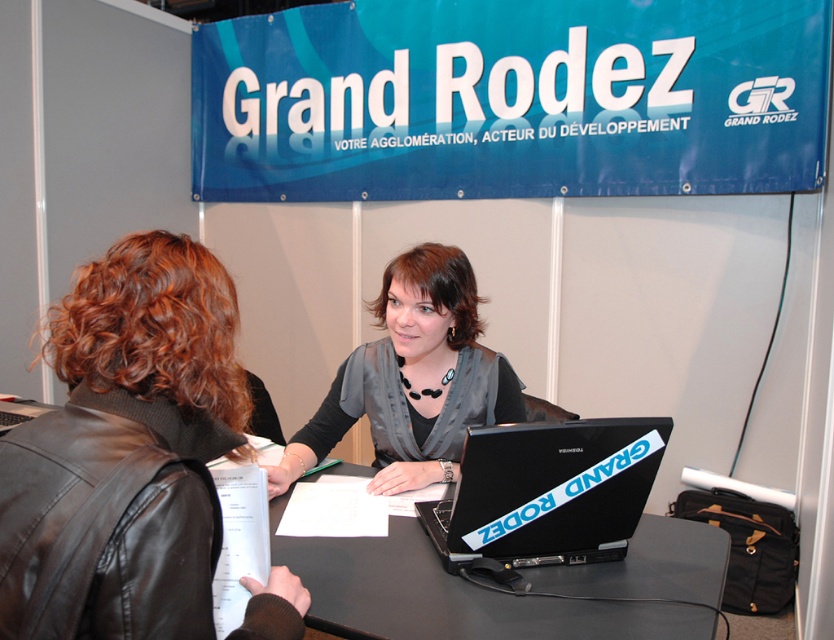
Who is more forward, (x=193, y=509) or (x=518, y=392)?

Point (x=193, y=509)

The width and height of the screenshot is (834, 640). What do you see at coordinates (124, 451) in the screenshot?
I see `black leather jacket at upper left` at bounding box center [124, 451].

Where is `black leather jacket at upper left`? The width and height of the screenshot is (834, 640). black leather jacket at upper left is located at coordinates (124, 451).

Locate an element on the screen. This screenshot has height=640, width=834. black leather jacket at upper left is located at coordinates (124, 451).

Between black matte table at center and black plastic laptop at center, which one has less height?

With less height is black matte table at center.

Is point (593, 588) less distant than point (456, 568)?

Yes, it is in front of point (456, 568).

Locate an element on the screen. This screenshot has height=640, width=834. black matte table at center is located at coordinates (446, 595).

Which is behind, point (184, 524) or point (390, 563)?

Point (390, 563)

Which is behind, point (186, 294) or point (355, 564)?

Positioned behind is point (355, 564).

The height and width of the screenshot is (640, 834). Find the location of `black leather jacket at upper left`. black leather jacket at upper left is located at coordinates 124,451.